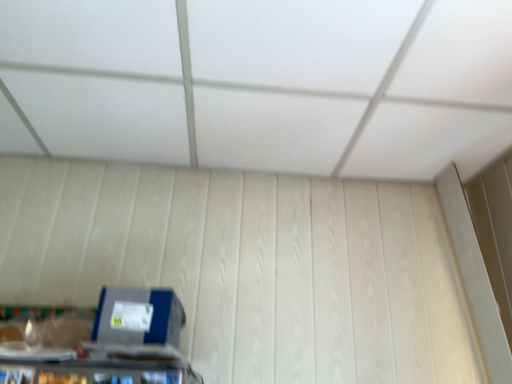
Question: Considering the positions of white matte exhaust hood at upper center and blue cardboard box at lower left in the image, is white matte exhaust hood at upper center wider or thinner than blue cardboard box at lower left?

Choices:
 (A) wide
 (B) thin

Answer: (A)

Question: Considering their positions, is white matte exhaust hood at upper center located in front of or behind blue cardboard box at lower left?

Choices:
 (A) behind
 (B) front

Answer: (B)

Question: Choose the correct answer: Is white matte exhaust hood at upper center inside blue cardboard box at lower left or outside it?

Choices:
 (A) inside
 (B) outside

Answer: (B)

Question: Looking at their shapes, would you say blue cardboard box at lower left is wider or thinner than white matte exhaust hood at upper center?

Choices:
 (A) wide
 (B) thin

Answer: (B)

Question: Looking at the image, does blue cardboard box at lower left seem bigger or smaller compared to white matte exhaust hood at upper center?

Choices:
 (A) big
 (B) small

Answer: (B)

Question: From the image's perspective, is blue cardboard box at lower left positioned above or below white matte exhaust hood at upper center?

Choices:
 (A) above
 (B) below

Answer: (B)

Question: From a real-world perspective, is blue cardboard box at lower left above or below white matte exhaust hood at upper center?

Choices:
 (A) below
 (B) above

Answer: (A)